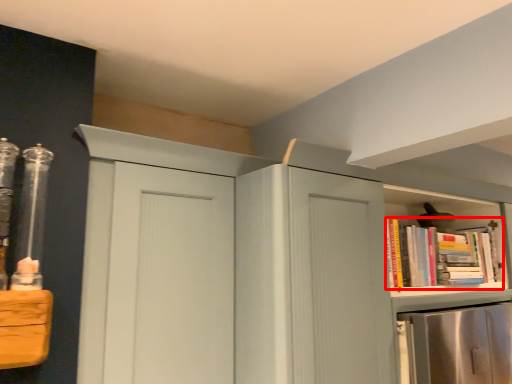
Question: From the image's perspective, what is the correct spatial relationship of book (annotated by the red box) in relation to cupboard?

Choices:
 (A) below
 (B) above

Answer: (B)